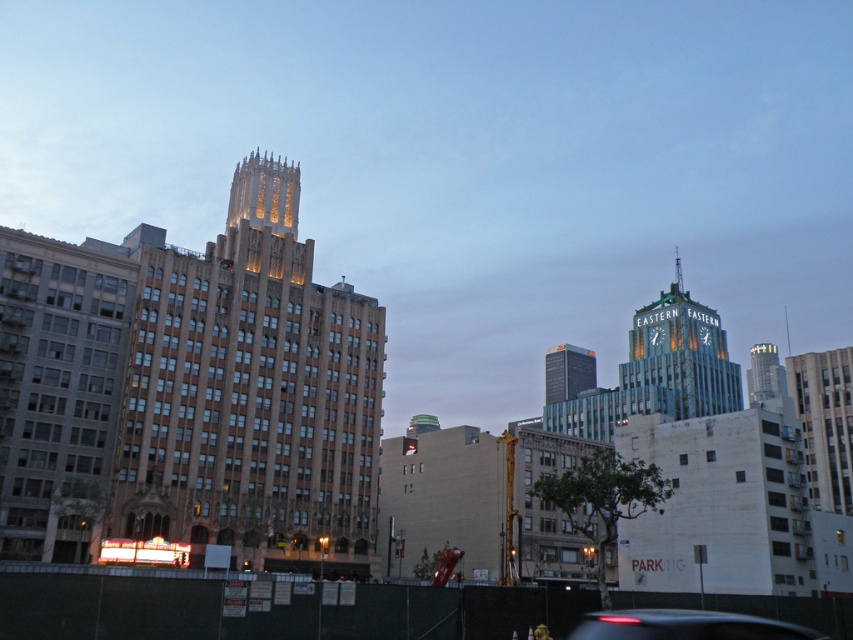
Looking at this image, who is higher up, black glossy car at lower center or glass skyscraper at upper right?

glass skyscraper at upper right is higher up.

Is point (599, 614) positioned in front of point (780, 376)?

Yes.

I want to click on black glossy car at lower center, so click(683, 625).

Can you confirm if blue glass clock tower at upper right is shorter than glass skyscraper at upper right?

Incorrect, blue glass clock tower at upper right's height does not fall short of glass skyscraper at upper right's.

Can you confirm if blue glass clock tower at upper right is thinner than glass skyscraper at upper right?

No, blue glass clock tower at upper right is not thinner than glass skyscraper at upper right.

At what (x,y) coordinates should I click in order to perform the action: click on blue glass clock tower at upper right. Please return your answer as a coordinate pair (x, y). The height and width of the screenshot is (640, 853). Looking at the image, I should click on (677, 358).

Looking at this image, can you confirm if black glossy car at lower center is positioned to the right of green glass skyscraper at center?

In fact, black glossy car at lower center is to the left of green glass skyscraper at center.

Which of these two, black glossy car at lower center or green glass skyscraper at center, stands shorter?

Standing shorter between the two is black glossy car at lower center.

Where is `black glossy car at lower center`? The width and height of the screenshot is (853, 640). black glossy car at lower center is located at coordinates (683, 625).